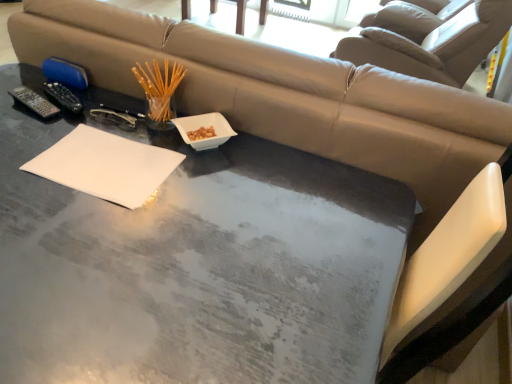
Where is `free space between white ceramic bowl at center and white matte notepad at center`? free space between white ceramic bowl at center and white matte notepad at center is located at coordinates (167, 157).